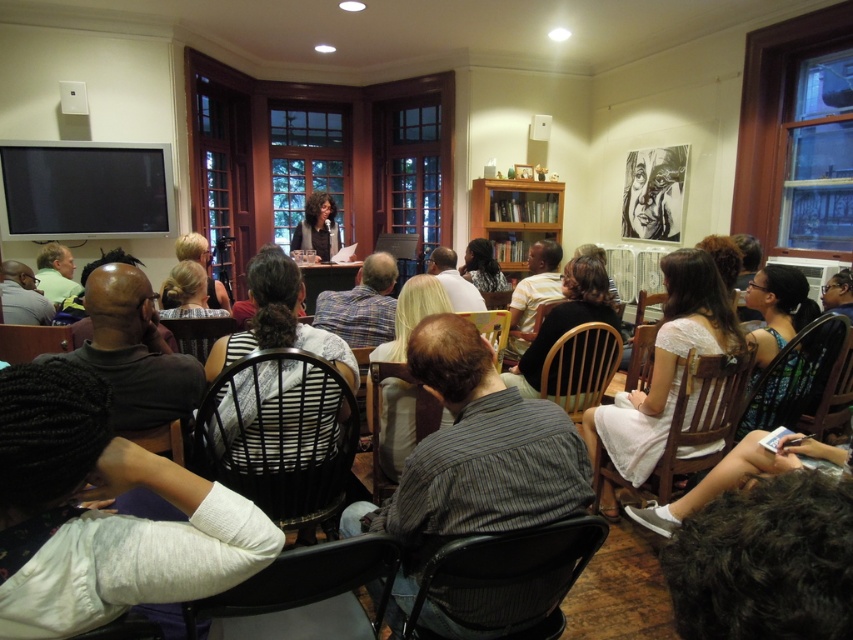
From the picture: You are sitting in the front row of the lecture hall and notice a point marked at coordinates [473,458]. What object is located at that point?

The point at coordinates [473,458] corresponds to the striped fabric shirt at center.

What is the object located at the coordinates point (515, 218) in the image?

The point (515, 218) indicates the wooden bookshelf at center.